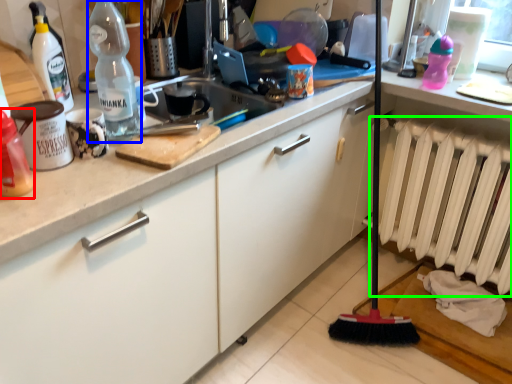
Question: Which is nearer to the bottle (highlighted by a red box)? bottle (highlighted by a blue box) or radiator (highlighted by a green box).

Choices:
 (A) bottle
 (B) radiator

Answer: (A)